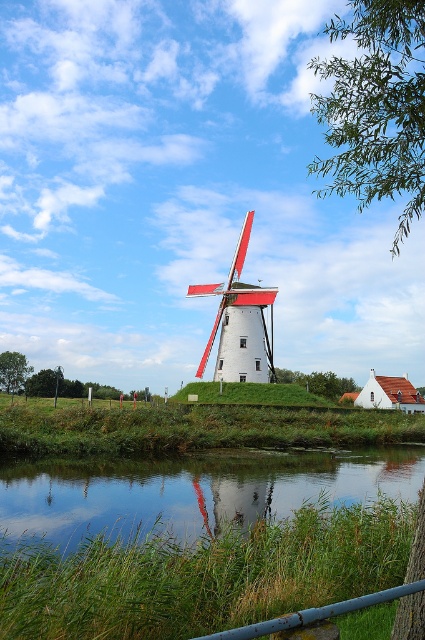
Can you confirm if transparent water at lower center is bigger than green leafy tree at center?

No.

Between transparent water at lower center and green leafy tree at center, which one appears on the left side from the viewer's perspective?

transparent water at lower center is more to the left.

Is point (71, 481) farther from camera compared to point (357, 388)?

No, (71, 481) is closer to viewer.

Identify the location of transparent water at lower center. Image resolution: width=425 pixels, height=640 pixels. (192, 490).

Between transparent water at lower center and green leafy tree at lower left, which one is positioned higher?

transparent water at lower center is higher up.

Between transparent water at lower center and green leafy tree at lower left, which one is positioned lower?

Positioned lower is green leafy tree at lower left.

Identify the location of transparent water at lower center. This screenshot has height=640, width=425. (192, 490).

Image resolution: width=425 pixels, height=640 pixels. Find the location of `transparent water at lower center`. transparent water at lower center is located at coordinates (192, 490).

Can you confirm if white matte windmill at center is thinner than green leafy tree at lower left?

No, white matte windmill at center is not thinner than green leafy tree at lower left.

Can you confirm if white matte windmill at center is taller than green leafy tree at lower left?

Correct, white matte windmill at center is much taller as green leafy tree at lower left.

Measure the distance between white matte windmill at center and camera.

The distance of white matte windmill at center from camera is 58.51 meters.

The width and height of the screenshot is (425, 640). What are the coordinates of `white matte windmill at center` in the screenshot? It's located at (240, 321).